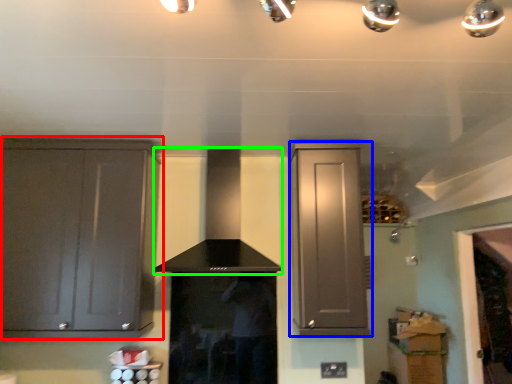
Question: Which object is positioned farthest from cabinetry (highlighted by a red box)? Select from cabinetry (highlighted by a blue box) and vent (highlighted by a green box).

Choices:
 (A) cabinetry
 (B) vent

Answer: (A)